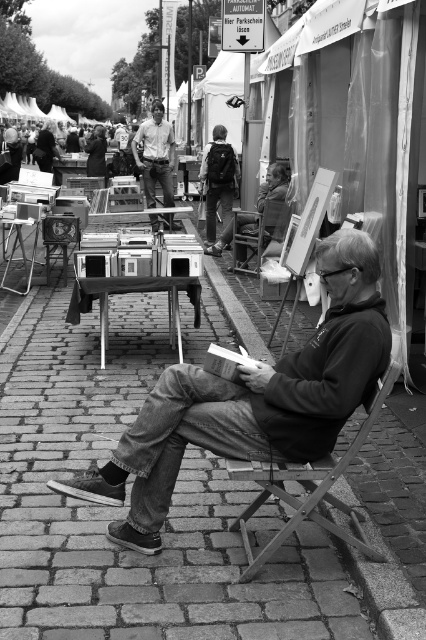
In the scene shown: Which of these two, metallic gray chair at center or wooden chair at center, stands taller?

Standing taller between the two is metallic gray chair at center.

Is metallic gray chair at center taller than wooden chair at center?

Yes.

Is point (270, 541) more distant than point (241, 221)?

No, (270, 541) is in front of (241, 221).

I want to click on metallic gray chair at center, so click(x=307, y=490).

Can you confirm if denim jeans at center is shorter than matte khaki pants at center?

Indeed, denim jeans at center has a lesser height compared to matte khaki pants at center.

Is point (181, 406) farther from camera compared to point (164, 154)?

No, it is not.

The width and height of the screenshot is (426, 640). What do you see at coordinates (253, 401) in the screenshot?
I see `denim jeans at center` at bounding box center [253, 401].

Identify the location of denim jeans at center. This screenshot has width=426, height=640. (253, 401).

Can you confirm if metallic gray chair at center is shorter than matte khaki pants at center?

Correct, metallic gray chair at center is not as tall as matte khaki pants at center.

Does point (367, 544) come in front of point (172, 140)?

Yes, it is in front of point (172, 140).

Where is `metallic gray chair at center`? Image resolution: width=426 pixels, height=640 pixels. metallic gray chair at center is located at coordinates (307, 490).